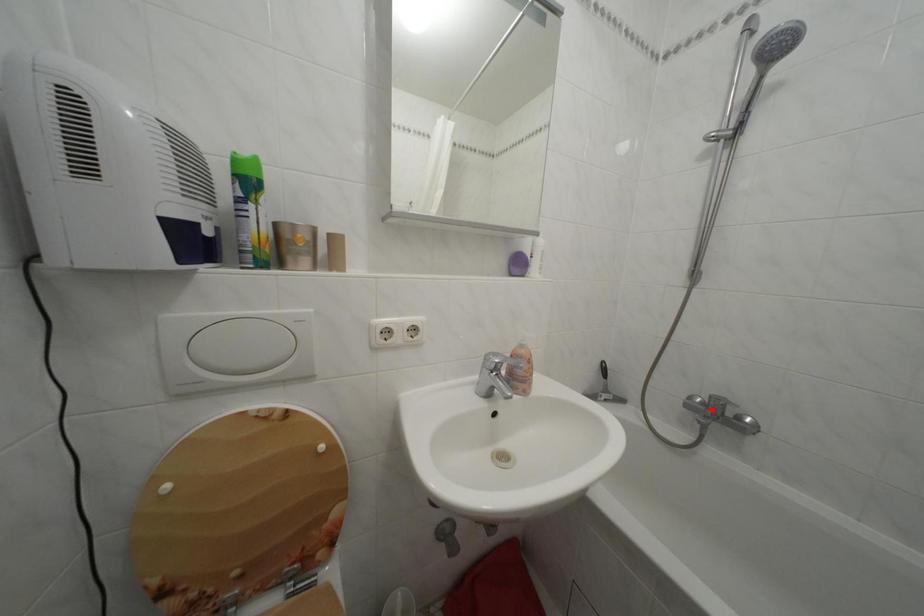
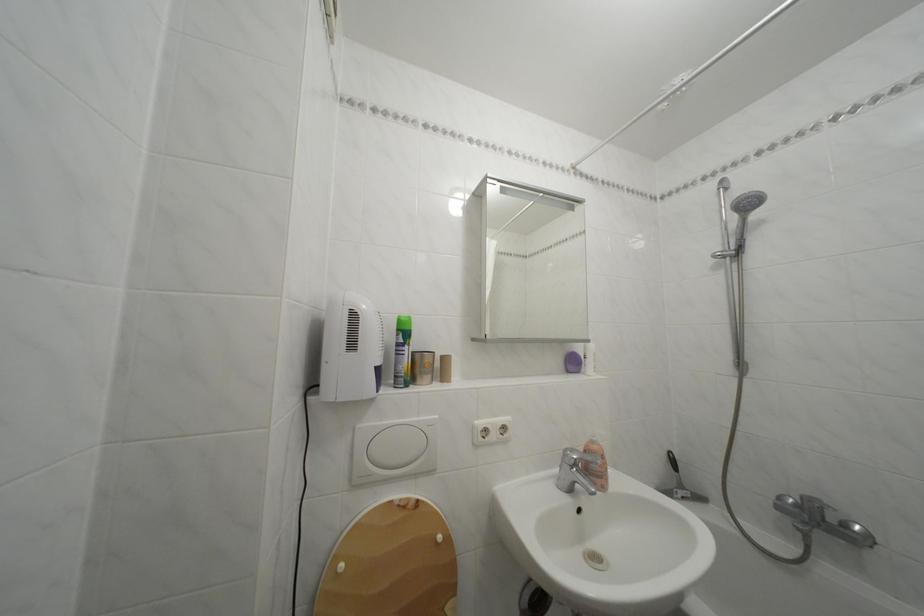
Find the pixel in the second image that matches the highlighted location in the first image.

(806, 512)